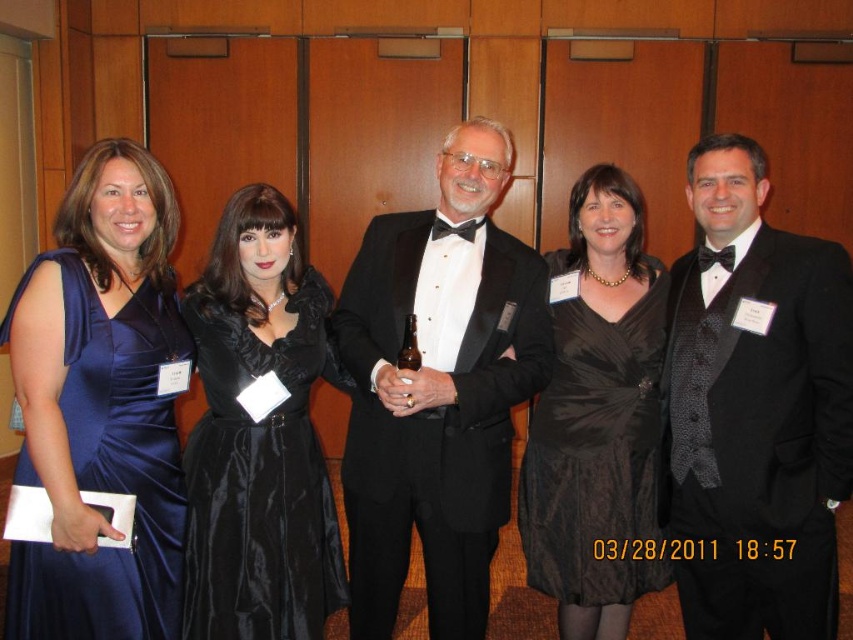
Based on the scene description, where is the black satin suit at center located in the image?

The black satin suit at center is located at point 0.644 on the x axis and 0.885 on the y axis.

You are a photographer at the event and need to adjust the lighting so that both the black satin suit at center and the black satin dress at center are equally visible. Considering their heights, which one might require a higher light source to ensure proper illumination?

The black satin suit at center is taller than the black satin dress at center, so the light source should be higher for the black satin suit at center to ensure both are illuminated properly.